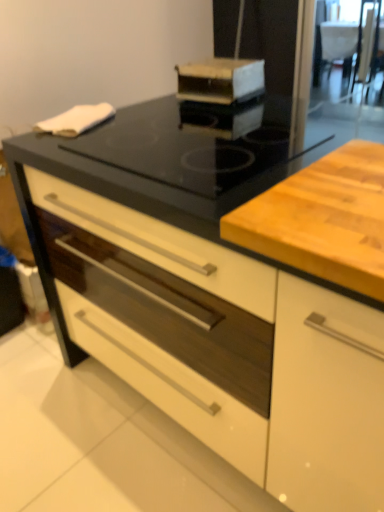
At what (x,y) coordinates should I click in order to perform the action: click on wooden cutting board at center. Please return your answer as a coordinate pair (x, y). The width and height of the screenshot is (384, 512). Looking at the image, I should click on (322, 219).

What is the approximate width of wooden box at upper center?

26.70 centimeters.

You are a GUI agent. You are given a task and a screenshot of the screen. Output one action in this format:
    pyautogui.click(x=<x>, y=<y>)
    Task: Click on the wooden cutting board at center
    
    Given the screenshot: What is the action you would take?
    pyautogui.click(x=322, y=219)

Consider the image. Is black glass gas stove at center facing towards transparent glass screen door at upper right?

No, black glass gas stove at center is not facing towards transparent glass screen door at upper right.

From a real-world perspective, is black glass gas stove at center above or below transparent glass screen door at upper right?

From a real-world perspective, black glass gas stove at center is physically above transparent glass screen door at upper right.

Considering the sizes of objects black glass gas stove at center and transparent glass screen door at upper right in the image provided, who is wider, black glass gas stove at center or transparent glass screen door at upper right?

With larger width is transparent glass screen door at upper right.

Can you tell me how much black glass gas stove at center and transparent glass screen door at upper right differ in facing direction?

The facing directions of black glass gas stove at center and transparent glass screen door at upper right are 90.4 degrees apart.

Does wooden cutting board at center contain wooden box at upper center?

Definitely not — wooden box at upper center is not inside wooden cutting board at center.

From the image's perspective, is wooden cutting board at center on top of wooden box at upper center?

No, from the image's perspective, wooden cutting board at center is not on top of wooden box at upper center.

Can you confirm if wooden cutting board at center is smaller than wooden box at upper center?

Actually, wooden cutting board at center might be larger than wooden box at upper center.

Are wooden cutting board at center and wooden box at upper center beside each other?

No.

Which object is further away from the camera taking this photo, black glass gas stove at center or wooden box at upper center?

wooden box at upper center is further away from the camera.

Is wooden box at upper center completely or partially inside black glass gas stove at center?

Definitely not — wooden box at upper center is not inside black glass gas stove at center.

Is black glass gas stove at center next to wooden box at upper center?

black glass gas stove at center is not next to wooden box at upper center, and they're not touching.

From the image's perspective, relative to wooden cutting board at center, is black glass gas stove at center above or below?

Clearly, from the image's perspective, black glass gas stove at center is above wooden cutting board at center.

Based on the photo, considering the sizes of black glass gas stove at center and wooden cutting board at center in the image, is black glass gas stove at center bigger or smaller than wooden cutting board at center?

Clearly, black glass gas stove at center is larger in size than wooden cutting board at center.

Can you tell me how much black glass gas stove at center and wooden cutting board at center differ in facing direction?

The angular difference between black glass gas stove at center and wooden cutting board at center is 180 degrees.

In the image, there is a black glass gas stove at center. At what (x,y) coordinates should I click in order to perform the action: click on counter below it (from the image's perspective). Please return your answer as a coordinate pair (x, y). This screenshot has height=512, width=384. Looking at the image, I should click on (322, 219).

What's the angular difference between wooden cutting board at center and black glass gas stove at center's facing directions?

The angle between the facing direction of wooden cutting board at center and the facing direction of black glass gas stove at center is 180 degrees.

Measure the distance from wooden cutting board at center to black glass gas stove at center.

The distance of wooden cutting board at center from black glass gas stove at center is 12.60 inches.

From a real-world perspective, is wooden cutting board at center positioned above or below black glass gas stove at center?

wooden cutting board at center is above black glass gas stove at center.

Based on their sizes in the image, would you say wooden cutting board at center is bigger or smaller than black glass gas stove at center?

Clearly, wooden cutting board at center is smaller in size than black glass gas stove at center.

Which of these two, wooden box at upper center or wooden cutting board at center, is smaller?

With smaller size is wooden box at upper center.

From the image's perspective, which is below, wooden box at upper center or wooden cutting board at center?

wooden cutting board at center, from the image's perspective.

Are wooden box at upper center and wooden cutting board at center making contact?

No, wooden box at upper center is not with wooden cutting board at center.

Is wooden box at upper center positioned with its back to wooden cutting board at center?

wooden box at upper center does not have its back to wooden cutting board at center.

Image resolution: width=384 pixels, height=512 pixels. Identify the location of gas stove lying below the transparent glass screen door at upper right (from the image's perspective). (196, 143).

Is transparent glass screen door at upper right aimed at black glass gas stove at center?

No, transparent glass screen door at upper right is not aimed at black glass gas stove at center.

Looking at this image, are transparent glass screen door at upper right and black glass gas stove at center beside each other?

They are not placed beside each other.

This screenshot has height=512, width=384. I want to click on screen door below the black glass gas stove at center (from a real-world perspective), so click(x=302, y=73).

Where is `kitchen appliance above the wooden cutting board at center (from a real-world perspective)`? Image resolution: width=384 pixels, height=512 pixels. kitchen appliance above the wooden cutting board at center (from a real-world perspective) is located at coordinates (221, 80).

When comparing their distances from wooden box at upper center, does black glass gas stove at center or transparent glass screen door at upper right seem closer?

Based on the image, black glass gas stove at center appears to be nearer to wooden box at upper center.

Based on their spatial positions, is transparent glass screen door at upper right or wooden box at upper center further from black glass gas stove at center?

transparent glass screen door at upper right.

Estimate the real-world distances between objects in this image. Which object is further from black glass gas stove at center, wooden box at upper center or transparent glass screen door at upper right?

Based on the image, transparent glass screen door at upper right appears to be further to black glass gas stove at center.

Based on their spatial positions, is transparent glass screen door at upper right or wooden box at upper center further from wooden cutting board at center?

The object further to wooden cutting board at center is transparent glass screen door at upper right.

From the image, which object appears to be farther from wooden box at upper center, wooden cutting board at center or transparent glass screen door at upper right?

Based on the image, wooden cutting board at center appears to be further to wooden box at upper center.

Estimate the real-world distances between objects in this image. Which object is further from wooden box at upper center, transparent glass screen door at upper right or black glass gas stove at center?

Among the two, transparent glass screen door at upper right is located further to wooden box at upper center.

When comparing their distances from transparent glass screen door at upper right, does wooden box at upper center or black glass gas stove at center seem further?

black glass gas stove at center is further to transparent glass screen door at upper right.

Considering their positions, is wooden box at upper center positioned further to black glass gas stove at center than wooden cutting board at center?

Among the two, wooden cutting board at center is located further to black glass gas stove at center.

This screenshot has height=512, width=384. Find the location of `kitchen appliance between black glass gas stove at center and transparent glass screen door at upper right along the z-axis`. kitchen appliance between black glass gas stove at center and transparent glass screen door at upper right along the z-axis is located at coordinates [x=221, y=80].

Identify the location of kitchen appliance positioned between wooden cutting board at center and transparent glass screen door at upper right from near to far. (221, 80).

Where is `gas stove located between wooden cutting board at center and transparent glass screen door at upper right in the depth direction`? The image size is (384, 512). gas stove located between wooden cutting board at center and transparent glass screen door at upper right in the depth direction is located at coordinates (196, 143).

Locate an element on the screen. Image resolution: width=384 pixels, height=512 pixels. gas stove between wooden cutting board at center and wooden box at upper center in the front-back direction is located at coordinates [196, 143].